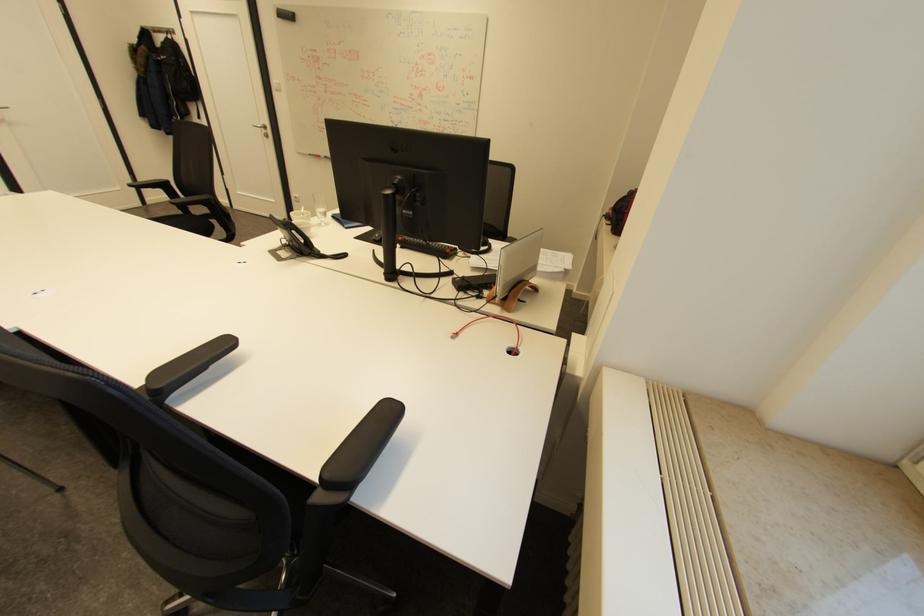
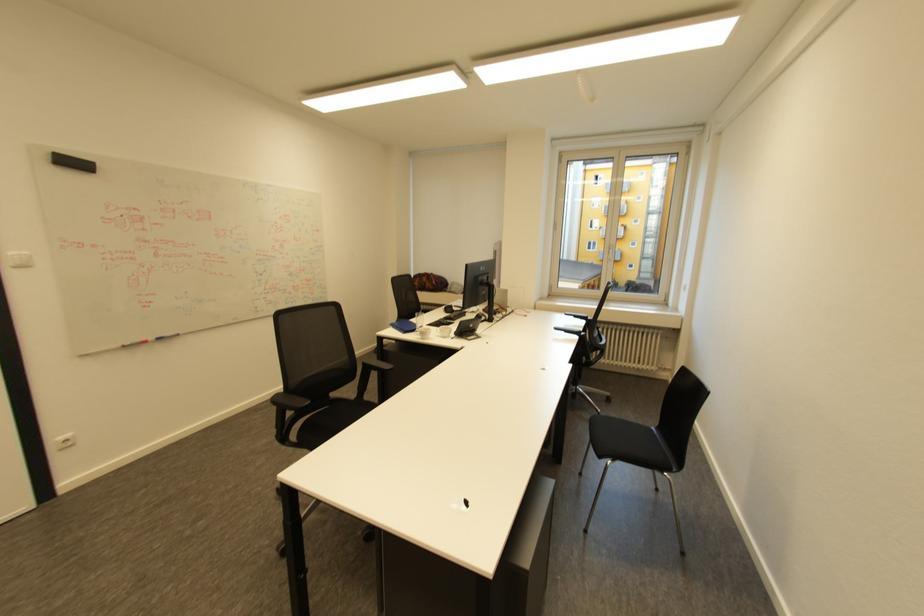
The point at [285,82] is marked in the first image. Where is the corresponding point in the second image?

(30, 253)